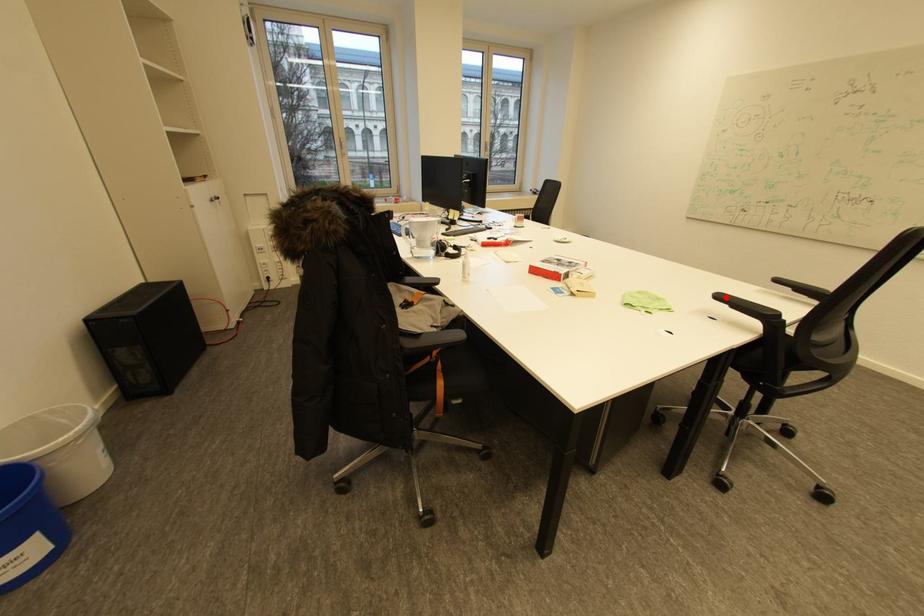
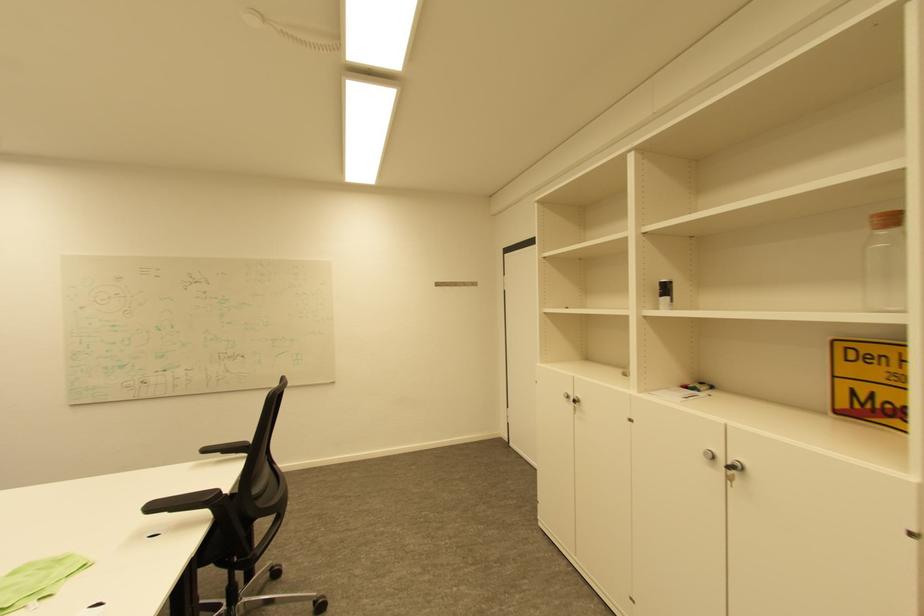
Locate, in the second image, the point that corresponds to the highlighted location in the first image.

(159, 508)